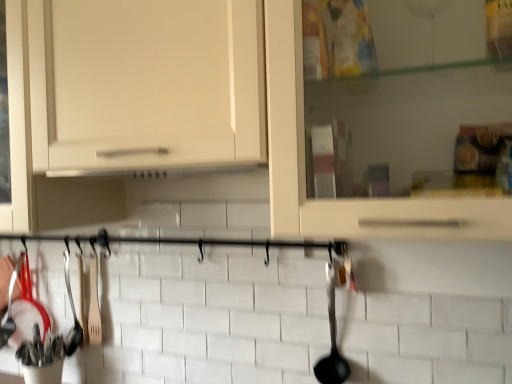
Question: From the image's perspective, would you say black plastic ladle at right, which is the second silverware from back to front, is shown under wooden spatula at left, acting as the second silverware starting from the right?

Choices:
 (A) no
 (B) yes

Answer: (A)

Question: Considering the relative sizes of black plastic ladle at right, placed as the first silverware when sorted from front to back, and wooden spatula at left, the 1th silverware viewed from the back, in the image provided, is black plastic ladle at right, placed as the first silverware when sorted from front to back, wider than wooden spatula at left, the 1th silverware viewed from the back,?

Choices:
 (A) no
 (B) yes

Answer: (B)

Question: Is black plastic ladle at right, the 1th silverware when ordered from right to left, located outside wooden spatula at left, which is the 1th silverware in left-to-right order?

Choices:
 (A) yes
 (B) no

Answer: (A)

Question: Does black plastic ladle at right, the 1th silverware when ordered from right to left, appear on the right side of wooden spatula at left, acting as the second silverware starting from the right?

Choices:
 (A) no
 (B) yes

Answer: (B)

Question: Could you tell me if black plastic ladle at right, the 1th silverware when ordered from right to left, is facing wooden spatula at left, which is the 1th silverware in left-to-right order?

Choices:
 (A) no
 (B) yes

Answer: (A)

Question: Is black plastic ladle at right, which is the second silverware from back to front, with wooden spatula at left, the 1th silverware viewed from the back?

Choices:
 (A) yes
 (B) no

Answer: (B)

Question: Is wooden spatula at left, which is the 1th silverware in left-to-right order, in contact with black plastic ladle at right, acting as the 2th silverware starting from the left?

Choices:
 (A) no
 (B) yes

Answer: (A)

Question: Is wooden spatula at left, acting as the second silverware starting from the right, thinner than black plastic ladle at right, which is the second silverware from back to front?

Choices:
 (A) yes
 (B) no

Answer: (A)

Question: Is wooden spatula at left, acting as the second silverware starting from the right, not near black plastic ladle at right, placed as the first silverware when sorted from front to back?

Choices:
 (A) no
 (B) yes

Answer: (A)

Question: Is wooden spatula at left, which is the 1th silverware in left-to-right order, wider than black plastic ladle at right, acting as the 2th silverware starting from the left?

Choices:
 (A) no
 (B) yes

Answer: (A)

Question: Does wooden spatula at left, the 1th silverware viewed from the back, come behind black plastic ladle at right, placed as the first silverware when sorted from front to back?

Choices:
 (A) no
 (B) yes

Answer: (B)

Question: From the image's perspective, is wooden spatula at left, which is the 1th silverware in left-to-right order, on top of black plastic ladle at right, the 1th silverware when ordered from right to left?

Choices:
 (A) yes
 (B) no

Answer: (B)

Question: Is white matte cabinet at center a part of black plastic ladle at right, which is the second silverware from back to front?

Choices:
 (A) no
 (B) yes

Answer: (A)